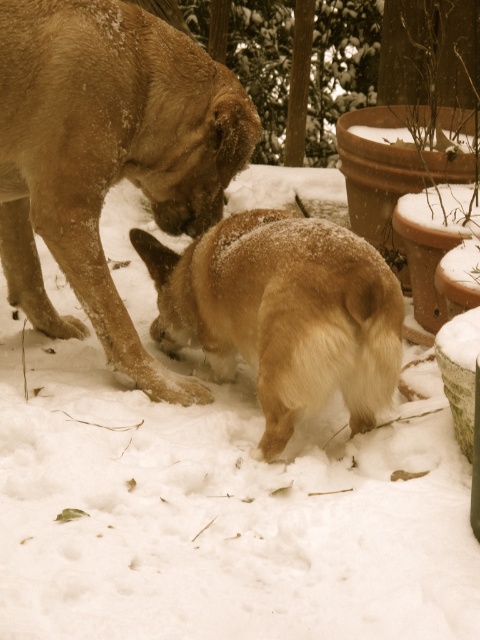
Which of these two, fuzzy fur dog at center or fuzzy brown dog at lower center, stands shorter?

fuzzy brown dog at lower center

Is fuzzy fur dog at center shorter than fuzzy brown dog at lower center?

Incorrect, fuzzy fur dog at center's height does not fall short of fuzzy brown dog at lower center's.

This screenshot has width=480, height=640. Find the location of `fuzzy fur dog at center`. fuzzy fur dog at center is located at coordinates (108, 156).